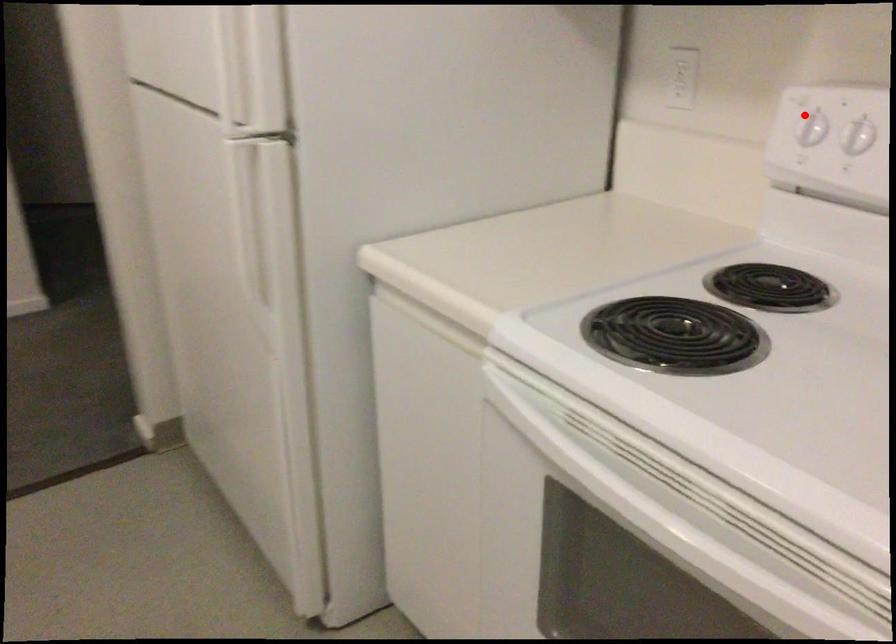
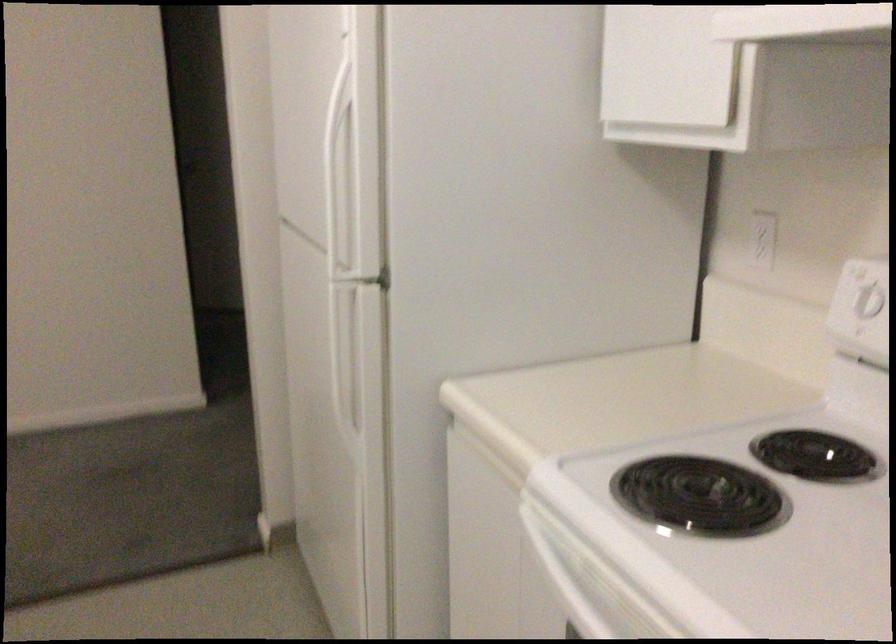
Where in the second image is the point corresponding to the highlighted location from the first image?

(864, 289)